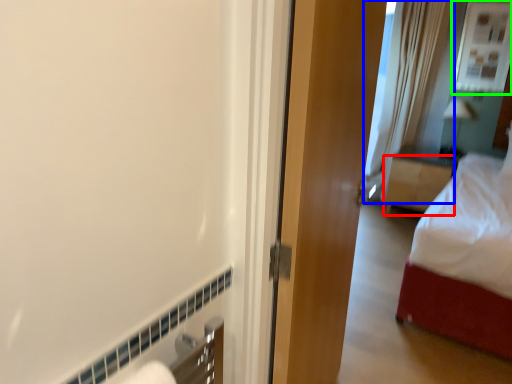
Question: Which object is the farthest from furniture (highlighted by a red box)? Choose among these: shower curtain (highlighted by a blue box) or window (highlighted by a green box).

Choices:
 (A) shower curtain
 (B) window

Answer: (B)